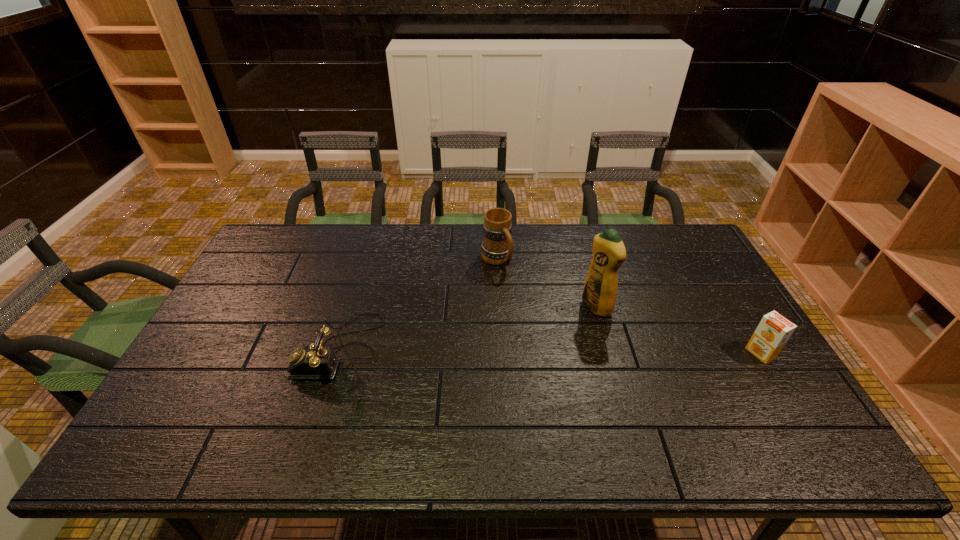
Where is `vacant space located 0.300m on the label of the tallest object`? The height and width of the screenshot is (540, 960). vacant space located 0.300m on the label of the tallest object is located at coordinates (508, 361).

I want to click on vacant region located 0.150m on the label of the tallest object, so click(549, 336).

Identify the location of vacant space situated on the label of the tallest object. (527, 349).

Locate an element on the screen. This screenshot has height=540, width=960. free point located on the side of the third object from right to left with the handle is located at coordinates (527, 300).

This screenshot has height=540, width=960. Find the location of `vacant area situated on the side of the third object from right to left with the handle`. vacant area situated on the side of the third object from right to left with the handle is located at coordinates (518, 288).

Locate an element on the screen. free space located 0.070m on the side of the third object from right to left with the handle is located at coordinates (515, 285).

Locate an element on the screen. This screenshot has height=540, width=960. object situated at the far edge is located at coordinates (497, 247).

Where is `object that is positioned at the near edge`? The width and height of the screenshot is (960, 540). object that is positioned at the near edge is located at coordinates (317, 361).

Where is `object present at the right edge`? object present at the right edge is located at coordinates (774, 330).

I want to click on vacant space at the far edge of the desktop, so click(517, 225).